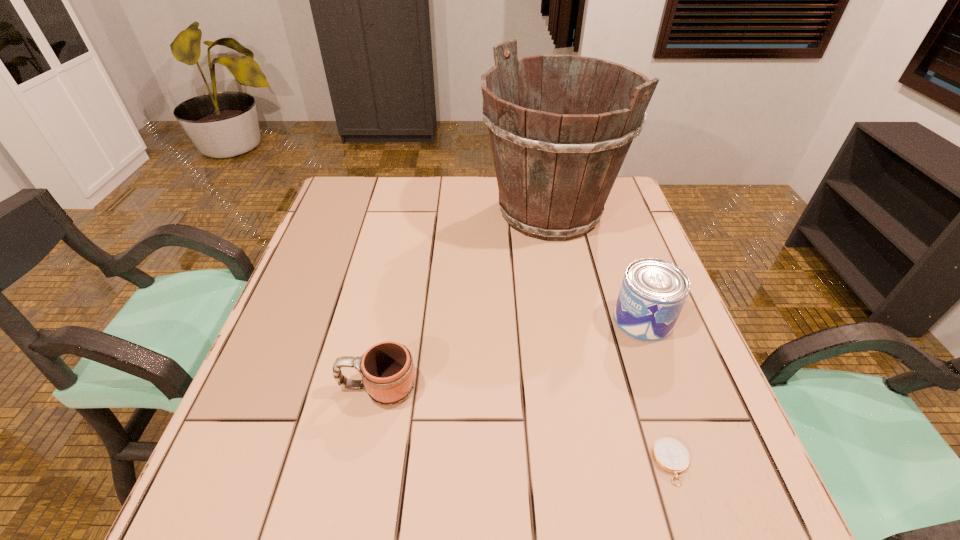
I want to click on vacant space located 0.380m on the front label of the third shortest object, so click(x=446, y=320).

Find the location of a particular element. This screenshot has width=960, height=540. vacant region located 0.080m on the front label of the third shortest object is located at coordinates (579, 320).

Image resolution: width=960 pixels, height=540 pixels. Identify the location of free space located 0.140m on the side of the second shortest object with the handle. (268, 388).

Locate an element on the screen. The image size is (960, 540). blank space located 0.090m on the side of the second shortest object with the handle is located at coordinates (293, 388).

At what (x,y) coordinates should I click in order to perform the action: click on blank space located 0.120m on the side of the second shortest object with the handle. Please return your answer as a coordinate pair (x, y). The width and height of the screenshot is (960, 540). Looking at the image, I should click on (278, 388).

Find the location of a particular element. This screenshot has width=960, height=540. free space located 0.130m on the back of the nearest object is located at coordinates (644, 379).

This screenshot has height=540, width=960. Find the location of `object that is positioned at the far edge`. object that is positioned at the far edge is located at coordinates (555, 171).

Locate an element on the screen. The image size is (960, 540). object positioned at the near edge is located at coordinates (669, 454).

Where is `bucket that is at the right edge`? The width and height of the screenshot is (960, 540). bucket that is at the right edge is located at coordinates (555, 171).

Identify the location of can positioned at the right edge. (653, 292).